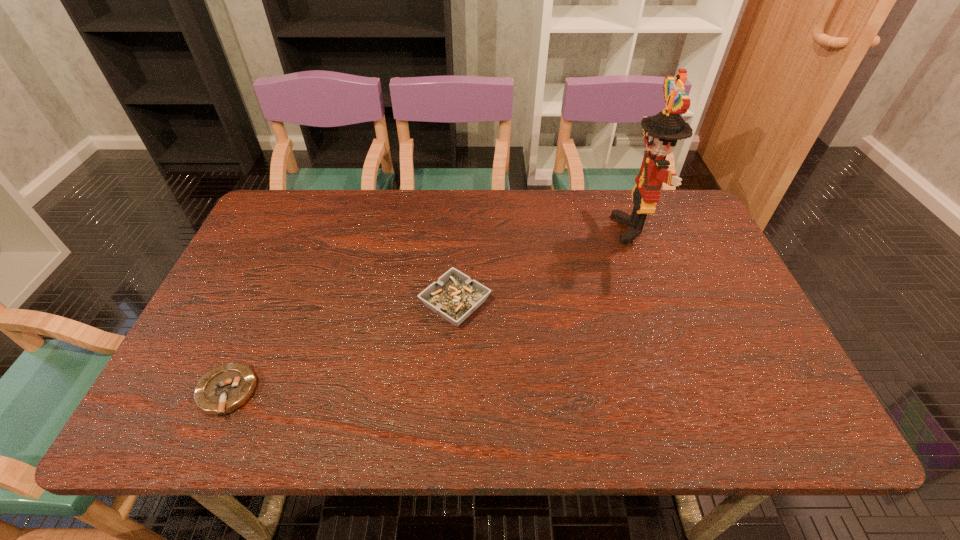
Locate an element on the screen. Image resolution: width=960 pixels, height=540 pixels. blank area in the image that satisfies the following two spatial constraints: 1. on the front-facing side of the tallest object; 2. on the front side of the taller ashtray is located at coordinates (662, 303).

Identify the location of vacant area in the image that satisfies the following two spatial constraints: 1. on the front-facing side of the rightmost object; 2. on the front side of the second object from left to right. (662, 303).